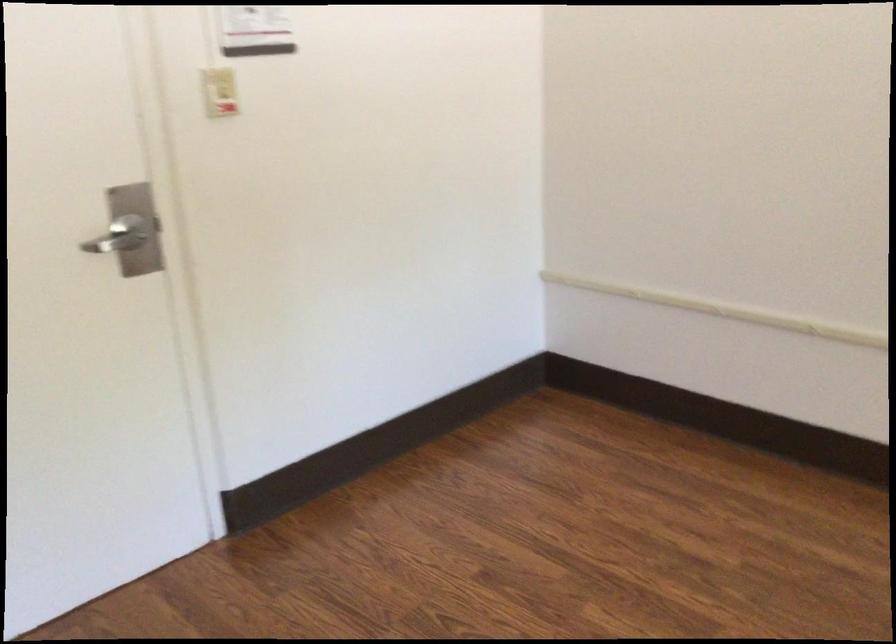
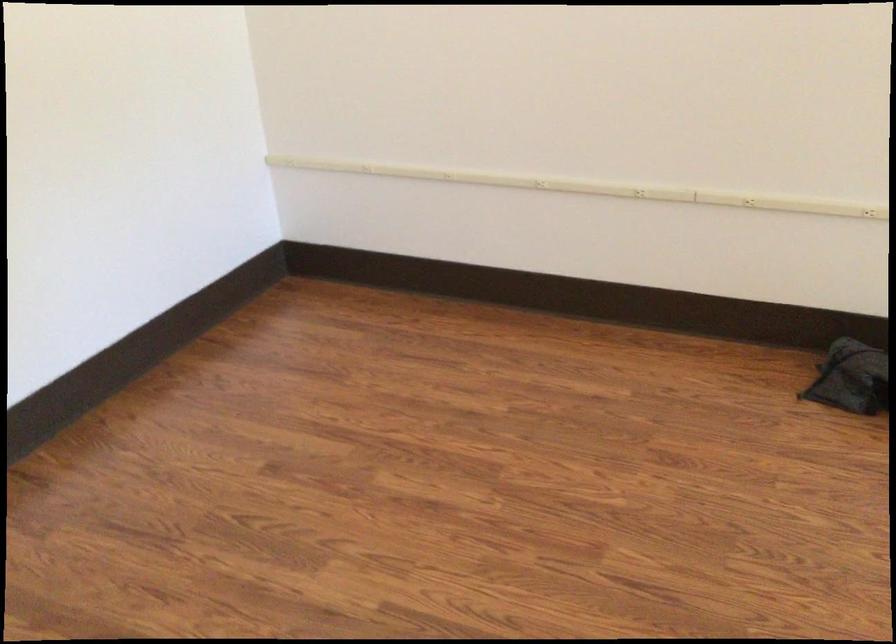
Question: The camera is either moving clockwise (left) or counter-clockwise (right) around the object. The first image is from the beginning of the video and the second image is from the end. Is the camera moving left or right when shooting the video?

Choices:
 (A) Left
 (B) Right

Answer: (A)